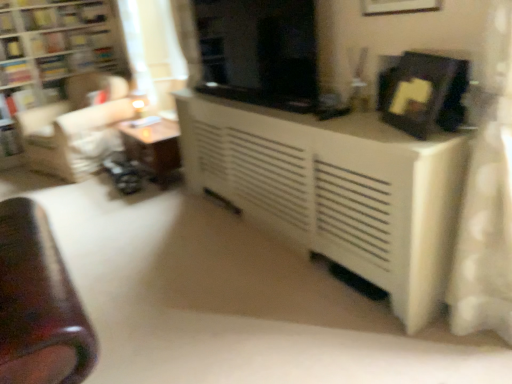
Question: Is matte black picture frame at upper center, arranged as the 2th picture frame when ordered from the bottom, positioned before wooden table at left, arranged as the 2th table when viewed from the right?

Choices:
 (A) no
 (B) yes

Answer: (B)

Question: Is matte black picture frame at upper center, the first picture frame viewed from the top, thinner than wooden table at left, arranged as the 2th table when viewed from the right?

Choices:
 (A) no
 (B) yes

Answer: (B)

Question: Is the position of matte black picture frame at upper center, the first picture frame viewed from the top, more distant than that of wooden table at left, marked as the first table in a back-to-front arrangement?

Choices:
 (A) no
 (B) yes

Answer: (A)

Question: From the image's perspective, is matte black picture frame at upper center, the first picture frame viewed from the top, below wooden table at left, arranged as the 2th table when viewed from the right?

Choices:
 (A) no
 (B) yes

Answer: (A)

Question: Can you confirm if matte black picture frame at upper center, the first picture frame viewed from the top, is bigger than wooden table at left, positioned as the first table in left-to-right order?

Choices:
 (A) no
 (B) yes

Answer: (A)

Question: Visually, is wooden bookshelf at left positioned to the left or to the right of black glossy screen door at center?

Choices:
 (A) left
 (B) right

Answer: (A)

Question: In the image, is wooden bookshelf at left positioned in front of or behind black glossy screen door at center?

Choices:
 (A) front
 (B) behind

Answer: (B)

Question: Considering the positions of point (0, 160) and point (236, 66), is point (0, 160) closer or farther from the camera than point (236, 66)?

Choices:
 (A) farther
 (B) closer

Answer: (A)

Question: Is wooden bookshelf at left bigger or smaller than black glossy screen door at center?

Choices:
 (A) small
 (B) big

Answer: (B)

Question: From a real-world perspective, is hardcover book at left, the 2th book when ordered from bottom to top, physically located above or below white matte book at left, which is counted as the first book, starting from the bottom?

Choices:
 (A) above
 (B) below

Answer: (A)

Question: Considering the positions of point (31, 87) and point (16, 140), is point (31, 87) closer or farther from the camera than point (16, 140)?

Choices:
 (A) closer
 (B) farther

Answer: (B)

Question: Relative to white matte book at left, which is counted as the first book, starting from the bottom, is hardcover book at left, the 2th book when ordered from bottom to top, in front or behind?

Choices:
 (A) behind
 (B) front

Answer: (B)

Question: In terms of height, does hardcover book at left, which is counted as the sixth book, starting from the top, look taller or shorter compared to white matte book at left, acting as the seventh book starting from the top?

Choices:
 (A) tall
 (B) short

Answer: (A)

Question: Would you say hardcover book at upper left, positioned as the sixth book in bottom-to-top order, is inside or outside white sheer curtain at upper left?

Choices:
 (A) outside
 (B) inside

Answer: (A)

Question: In the image, is hardcover book at upper left, which ranks as the second book in top-to-bottom order, on the left side or the right side of white sheer curtain at upper left?

Choices:
 (A) right
 (B) left

Answer: (B)